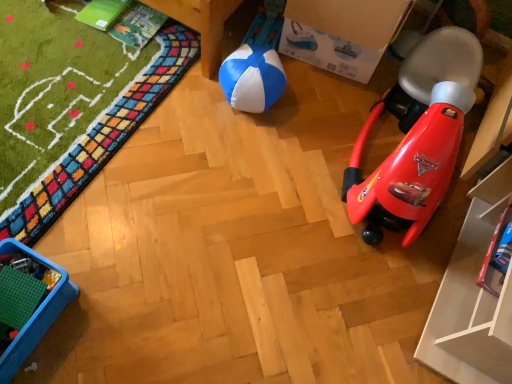
Question: In the image, is red plastic rocket at right, arranged as the second toy when ordered from the bottom, on the left side or the right side of blue/white fabric ball at center?

Choices:
 (A) left
 (B) right

Answer: (B)

Question: In the image, is red plastic rocket at right, positioned as the 1th toy in top-to-bottom order, positioned in front of or behind blue/white fabric ball at center?

Choices:
 (A) behind
 (B) front

Answer: (B)

Question: Which of these objects is positioned farthest from the red plastic rocket at right, arranged as the second toy when ordered from the bottom?

Choices:
 (A) metallic blue toy car at lower right, which is counted as the 1th toy, starting from the bottom
 (B) blue plastic tray at lower left
 (C) cardboard box at upper center
 (D) blue/white fabric ball at center

Answer: (B)

Question: Estimate the real-world distances between objects in this image. Which object is farther from the metallic blue toy car at lower right, the second toy from the top?

Choices:
 (A) blue/white fabric ball at center
 (B) cardboard box at upper center
 (C) red plastic rocket at right, positioned as the 1th toy in top-to-bottom order
 (D) blue plastic tray at lower left

Answer: (D)